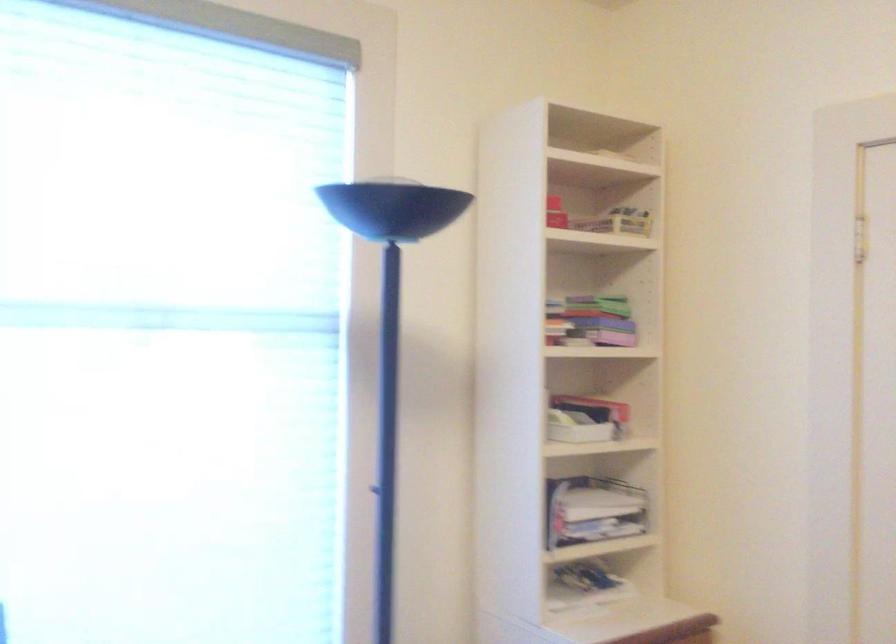
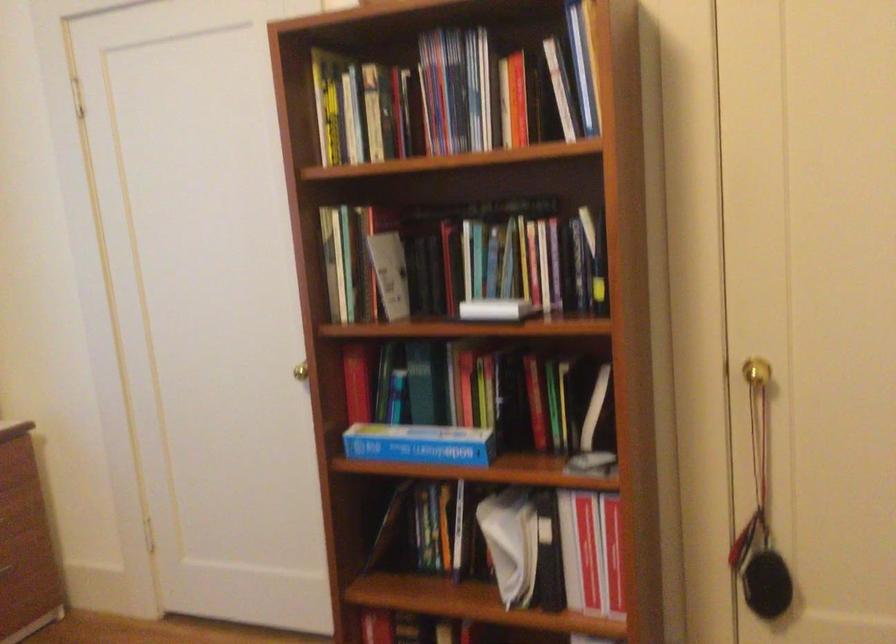
Question: The camera is either moving clockwise (left) or counter-clockwise (right) around the object. The first image is from the beginning of the video and the second image is from the end. Is the camera moving left or right when shooting the video?

Choices:
 (A) Left
 (B) Right

Answer: (A)